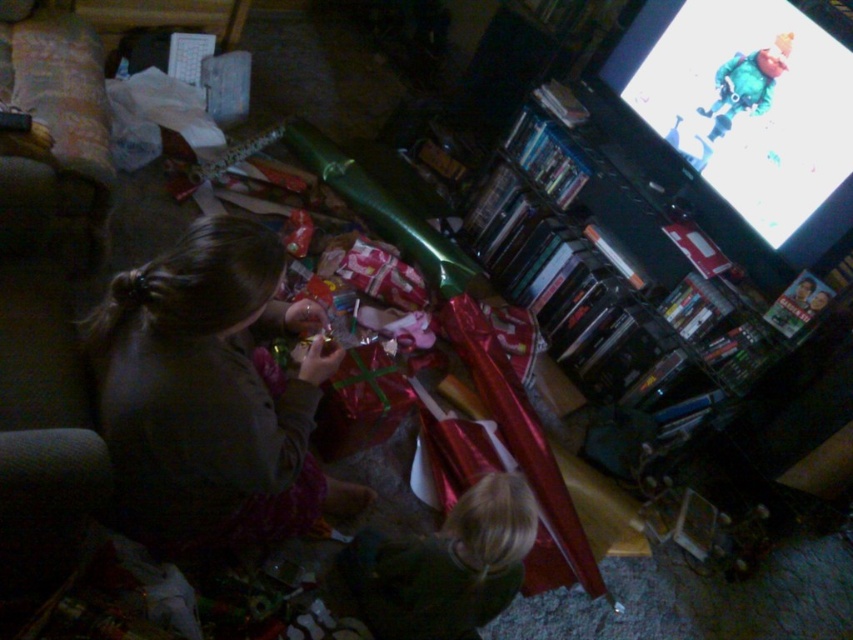
Question: Where is dark gray sweater at center located in relation to blonde hair at lower center in the image?

Choices:
 (A) right
 (B) left

Answer: (B)

Question: Which point is farther from the camera taking this photo?

Choices:
 (A) (515, 582)
 (B) (163, 422)

Answer: (A)

Question: Can you confirm if dark gray sweater at center is positioned below blonde hair at lower center?

Choices:
 (A) yes
 (B) no

Answer: (B)

Question: Can you confirm if dark gray sweater at center is positioned to the right of blonde hair at lower center?

Choices:
 (A) yes
 (B) no

Answer: (B)

Question: Which object appears farthest from the camera in this image?

Choices:
 (A) dark gray sweater at center
 (B) blonde hair at lower center

Answer: (B)